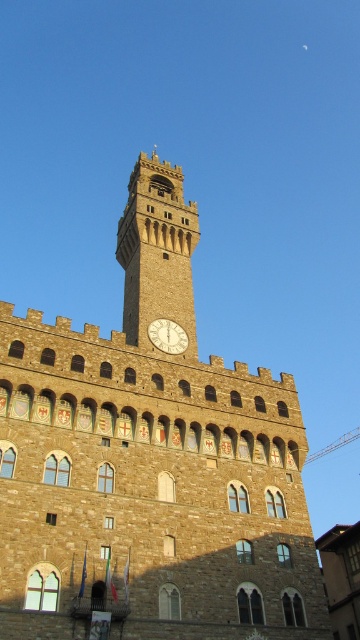
You are standing in front of a historic Italian Renaissance building with a clock tower. There is a point marked at coordinates (156, 252). What does this point represent?

The point at coordinates (156, 252) indicates the stone clock tower at center.

You are standing in front of the historic stone building and looking at the two points marked on the image. Which point, point (183, 298) or point (165, 326), is closer to you?

Point (183, 298) is further to the camera than point (165, 326), so the point closer to you is point (165, 326).